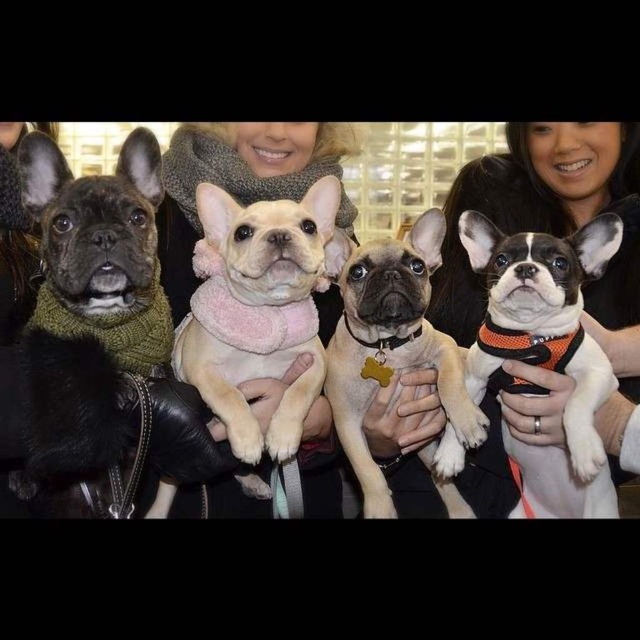
Can you confirm if white and black fur at right is positioned to the left of light beige fur at center?

In fact, white and black fur at right is to the right of light beige fur at center.

Who is higher up, white and black fur at right or light beige fur at center?

white and black fur at right is higher up.

This screenshot has width=640, height=640. I want to click on white and black fur at right, so click(545, 353).

Can you confirm if matte black dog at left is smaller than white and black fur at right?

Yes.

Is matte black dog at left wider than white and black fur at right?

Incorrect, matte black dog at left's width does not surpass white and black fur at right's.

The width and height of the screenshot is (640, 640). What are the coordinates of `matte black dog at left` in the screenshot? It's located at (90, 300).

Locate an element on the screen. matte black dog at left is located at coordinates (90, 300).

Is point (198, 198) closer to viewer compared to point (429, 292)?

That is True.

Can you confirm if peachy fleece dog at center is positioned to the right of light beige fur at center?

No, peachy fleece dog at center is not to the right of light beige fur at center.

Does point (285, 339) lie behind point (380, 250)?

No, it is not.

Identify the location of peachy fleece dog at center. Image resolution: width=640 pixels, height=640 pixels. (257, 310).